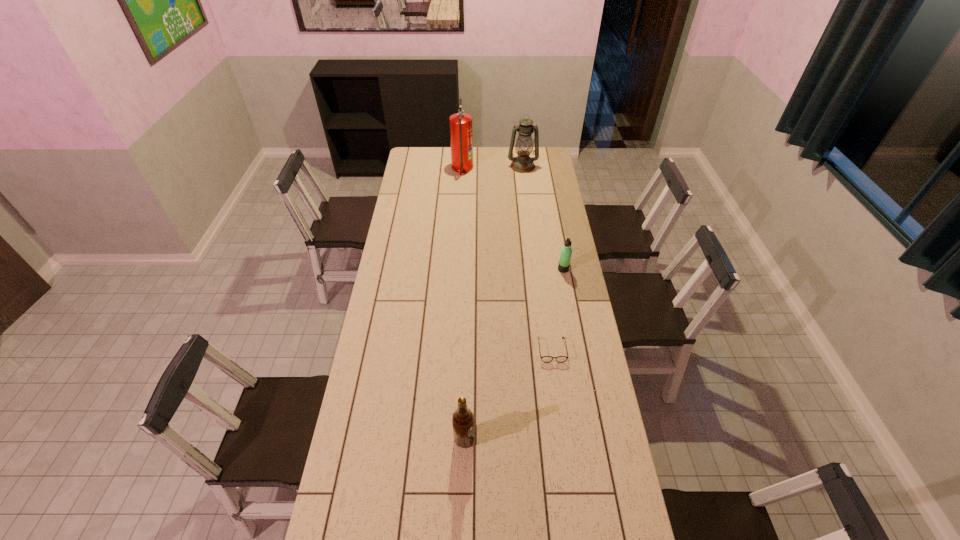
Where is `the tallest object`? This screenshot has height=540, width=960. the tallest object is located at coordinates (461, 127).

Where is `oil lamp`? This screenshot has height=540, width=960. oil lamp is located at coordinates (522, 163).

At what (x,y) coordinates should I click in order to perform the action: click on the nearest object. Please return your answer as a coordinate pair (x, y). The image size is (960, 540). Looking at the image, I should click on (462, 419).

You are a GUI agent. You are given a task and a screenshot of the screen. Output one action in this format:
    pyautogui.click(x=<x>, y=<y>)
    Task: Click on the beer bottle
    
    Given the screenshot: What is the action you would take?
    pyautogui.click(x=462, y=419)

Find the location of `thermos bottle`. thermos bottle is located at coordinates (566, 251).

This screenshot has width=960, height=540. Identify the location of the second shortest object. (566, 251).

In order to click on the second nearest object in this screenshot , I will do `click(560, 359)`.

Locate an element on the screen. The image size is (960, 540). the shortest object is located at coordinates (560, 359).

The height and width of the screenshot is (540, 960). Identify the location of vacant space located on the instruction side of the tallest object. (495, 168).

This screenshot has height=540, width=960. Find the location of `vacant region located 0.340m on the front of the oil lamp`. vacant region located 0.340m on the front of the oil lamp is located at coordinates (528, 208).